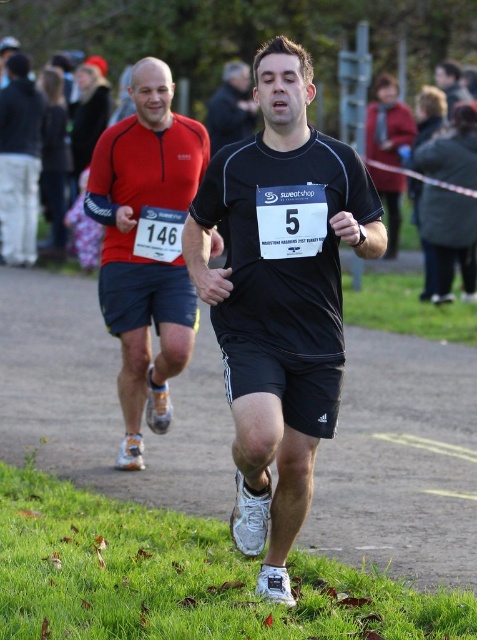
Which is below, matte black shorts at left or black matte running shorts at center?

matte black shorts at left

Which is behind, point (29, 84) or point (232, 125)?

The point (232, 125) is behind.

I want to click on matte black shorts at left, so click(x=19, y=163).

Who is positioned more to the left, black matte running shirt at center or matte red running shirt at left?

Positioned to the left is matte red running shirt at left.

Can you confirm if black matte running shirt at center is positioned to the left of matte red running shirt at left?

Incorrect, black matte running shirt at center is not on the left side of matte red running shirt at left.

At what (x,y) coordinates should I click in order to perform the action: click on black matte running shirt at center. Please return your answer as a coordinate pair (x, y). This screenshot has width=477, height=640. Looking at the image, I should click on (279, 298).

Is point (253, 112) closer to camera compared to point (465, 92)?

No, (253, 112) is further to viewer.

Locate an element on the screen. The height and width of the screenshot is (640, 477). black matte running shorts at center is located at coordinates (230, 108).